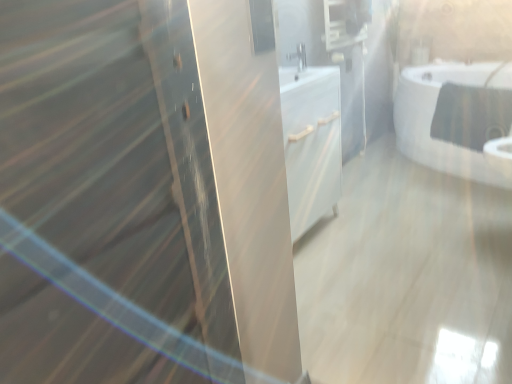
Question: Considering the relative sizes of matte black medicine cabinet at upper center and satin nickel faucet at center in the image provided, is matte black medicine cabinet at upper center thinner than satin nickel faucet at center?

Choices:
 (A) yes
 (B) no

Answer: (B)

Question: Does matte black medicine cabinet at upper center come behind satin nickel faucet at center?

Choices:
 (A) no
 (B) yes

Answer: (B)

Question: Considering the relative sizes of matte black medicine cabinet at upper center and satin nickel faucet at center in the image provided, is matte black medicine cabinet at upper center smaller than satin nickel faucet at center?

Choices:
 (A) yes
 (B) no

Answer: (B)

Question: Can we say matte black medicine cabinet at upper center lies outside satin nickel faucet at center?

Choices:
 (A) no
 (B) yes

Answer: (B)

Question: From a real-world perspective, is matte black medicine cabinet at upper center located beneath satin nickel faucet at center?

Choices:
 (A) yes
 (B) no

Answer: (B)

Question: Can you confirm if matte black medicine cabinet at upper center is positioned to the left of satin nickel faucet at center?

Choices:
 (A) no
 (B) yes

Answer: (A)

Question: From a real-world perspective, is white glossy bathtub at upper right on top of satin nickel faucet at center?

Choices:
 (A) yes
 (B) no

Answer: (B)

Question: Is satin nickel faucet at center located within white glossy bathtub at upper right?

Choices:
 (A) no
 (B) yes

Answer: (A)

Question: Considering the relative sizes of white glossy bathtub at upper right and satin nickel faucet at center in the image provided, is white glossy bathtub at upper right thinner than satin nickel faucet at center?

Choices:
 (A) no
 (B) yes

Answer: (A)

Question: From the image's perspective, is white glossy bathtub at upper right above satin nickel faucet at center?

Choices:
 (A) yes
 (B) no

Answer: (B)

Question: Is white glossy bathtub at upper right behind satin nickel faucet at center?

Choices:
 (A) yes
 (B) no

Answer: (A)

Question: Can you confirm if white glossy bathtub at upper right is wider than satin nickel faucet at center?

Choices:
 (A) no
 (B) yes

Answer: (B)

Question: Considering the relative sizes of matte black medicine cabinet at upper center and white glossy bathtub at upper right in the image provided, is matte black medicine cabinet at upper center thinner than white glossy bathtub at upper right?

Choices:
 (A) no
 (B) yes

Answer: (B)